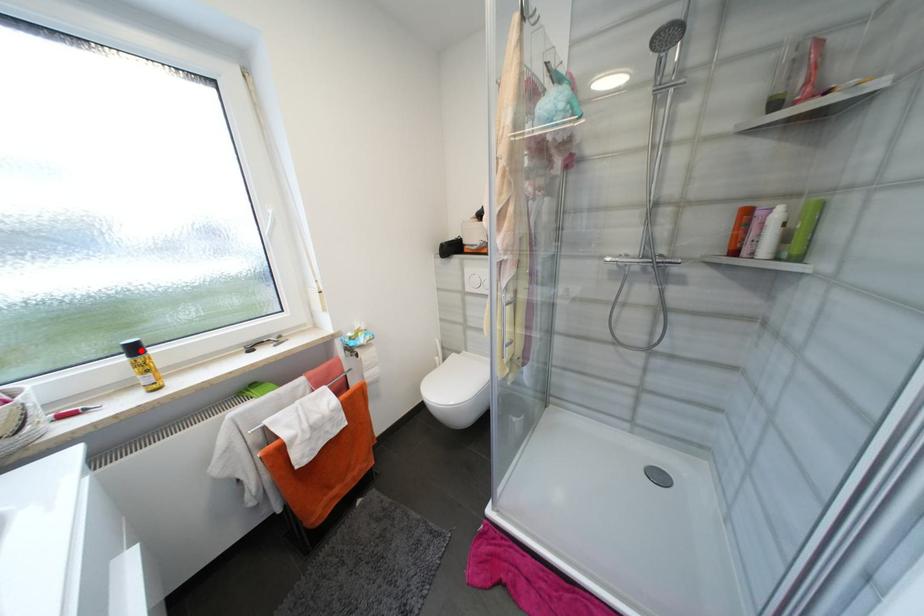
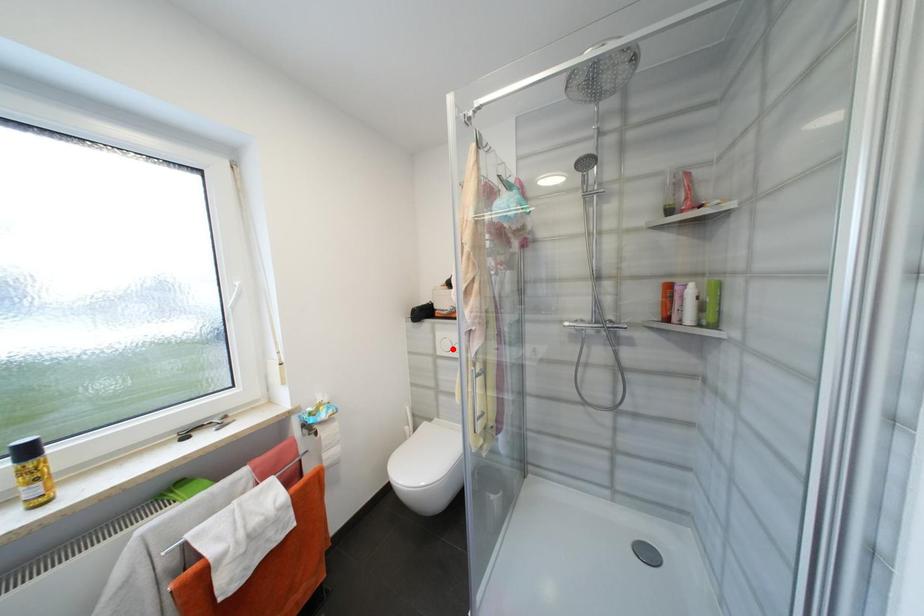
I am providing you with two images of the same scene from different viewpoints. A red point is marked on the first image and another point is marked on the second image. Are the points marked in image1 and image2 representing the same 3D position?

No